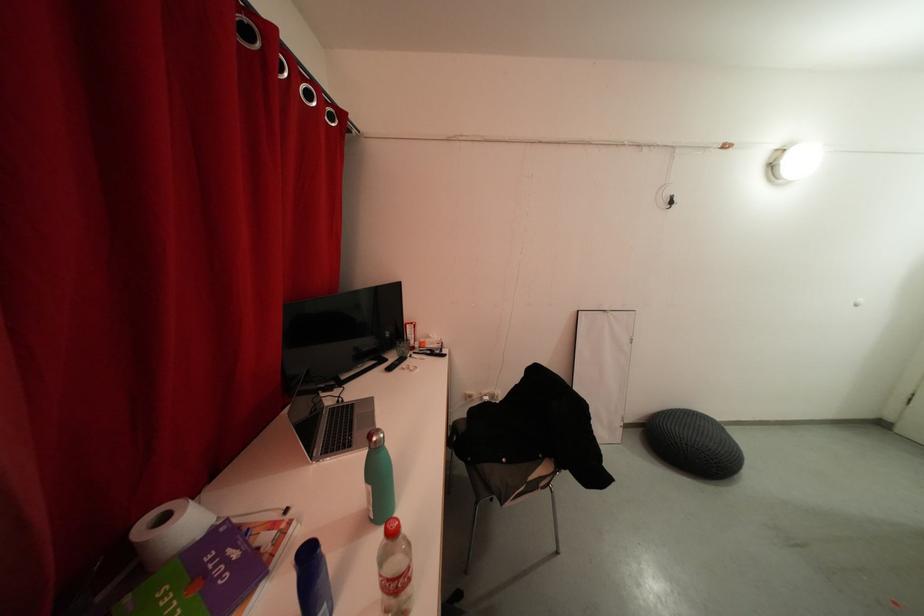
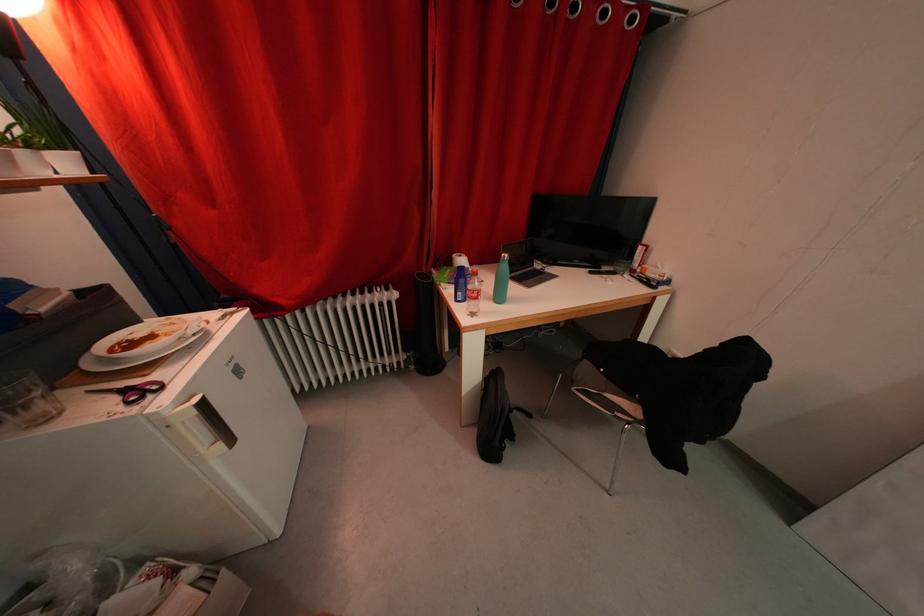
First-person continuous shooting, in which direction is the camera rotating?

The rotation direction of the camera is left-down.